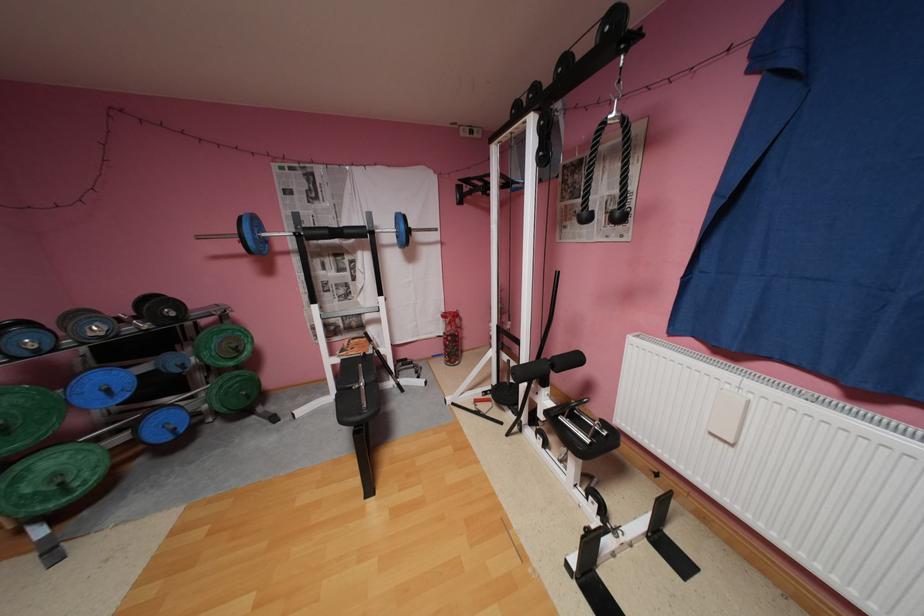
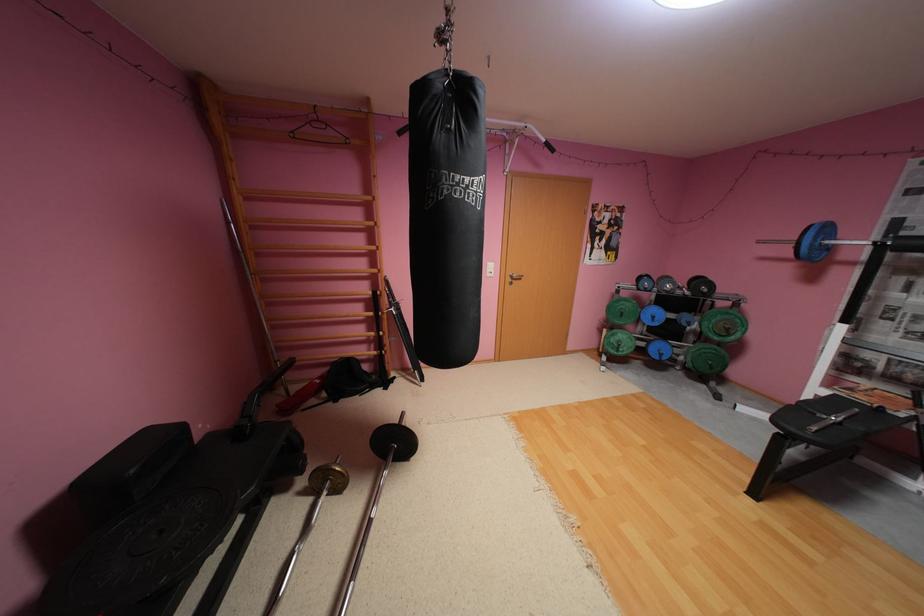
Based on the continuous images, in which direction is the camera rotating?

The camera rotated toward left-down.